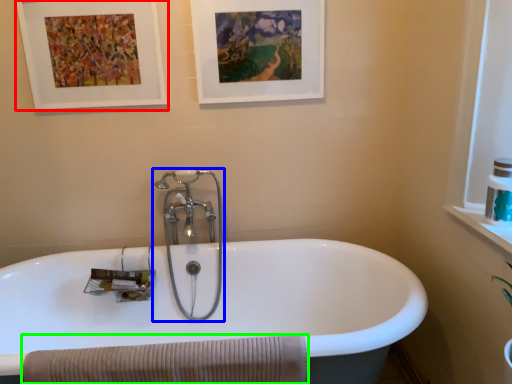
Question: Considering the real-world distances, which object is closest to picture frame (highlighted by a red box)? tap (highlighted by a blue box) or bath towel (highlighted by a green box).

Choices:
 (A) tap
 (B) bath towel

Answer: (A)